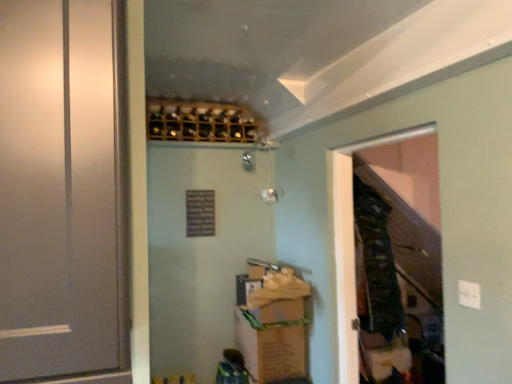
Question: Does white matte door at left have a greater width compared to camouflage fabric laundry at right?

Choices:
 (A) no
 (B) yes

Answer: (B)

Question: Can camouflage fabric laundry at right be found inside white matte door at left?

Choices:
 (A) yes
 (B) no

Answer: (B)

Question: Is white matte door at left bigger than camouflage fabric laundry at right?

Choices:
 (A) no
 (B) yes

Answer: (B)

Question: Does white matte door at left come in front of camouflage fabric laundry at right?

Choices:
 (A) yes
 (B) no

Answer: (A)

Question: Is white matte door at left next to camouflage fabric laundry at right?

Choices:
 (A) no
 (B) yes

Answer: (A)

Question: From a real-world perspective, is white matte door at left over camouflage fabric laundry at right?

Choices:
 (A) yes
 (B) no

Answer: (A)

Question: Considering the relative sizes of camouflage fabric laundry at right and brown cardboard box at lower center in the image provided, is camouflage fabric laundry at right thinner than brown cardboard box at lower center?

Choices:
 (A) yes
 (B) no

Answer: (A)

Question: Does camouflage fabric laundry at right appear on the right side of brown cardboard box at lower center?

Choices:
 (A) yes
 (B) no

Answer: (A)

Question: Could you tell me if camouflage fabric laundry at right is turned towards brown cardboard box at lower center?

Choices:
 (A) yes
 (B) no

Answer: (B)

Question: From a real-world perspective, is camouflage fabric laundry at right located beneath brown cardboard box at lower center?

Choices:
 (A) no
 (B) yes

Answer: (A)

Question: From the image's perspective, is camouflage fabric laundry at right under brown cardboard box at lower center?

Choices:
 (A) yes
 (B) no

Answer: (B)

Question: Would you say camouflage fabric laundry at right is outside brown cardboard box at lower center?

Choices:
 (A) yes
 (B) no

Answer: (A)

Question: Can you confirm if wooden screen door at right is smaller than wooden wine rack at upper center?

Choices:
 (A) yes
 (B) no

Answer: (A)